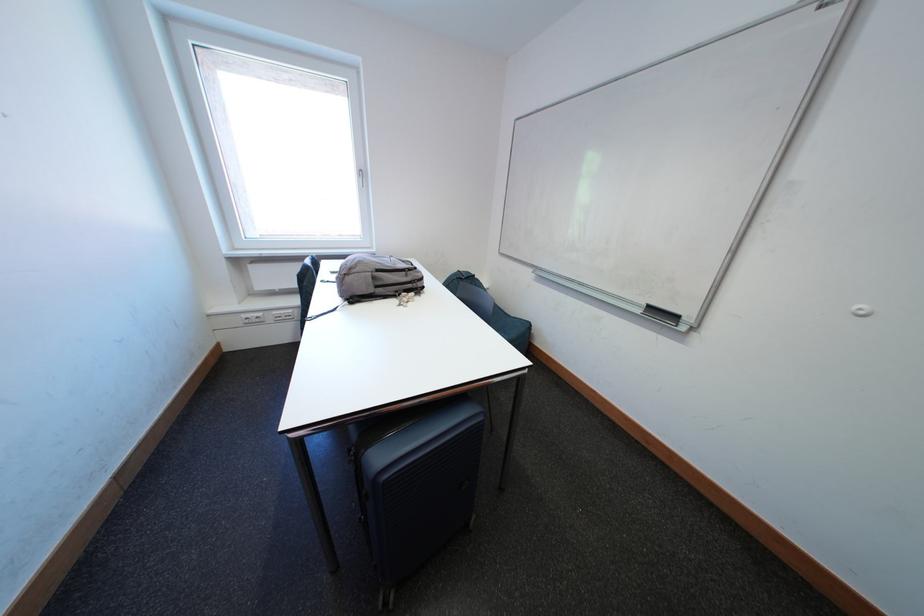
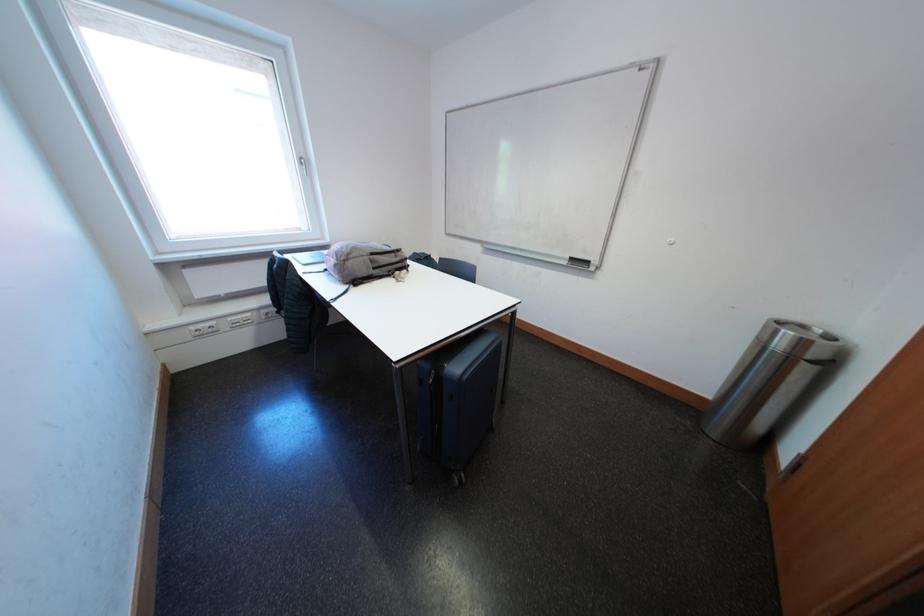
Find the pixel in the second image that matches pixel 253 320 in the first image.

(202, 331)